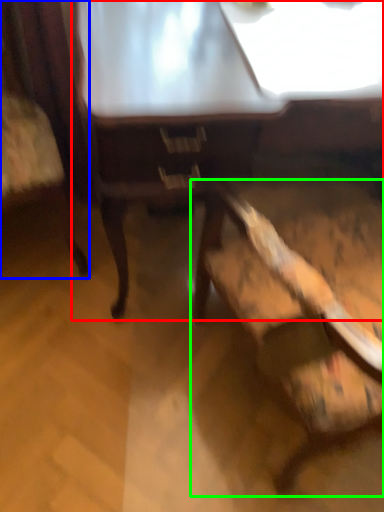
Question: Which object is positioned closest to table (highlighted by a red box)? Select from chair (highlighted by a blue box) and chair (highlighted by a green box).

Choices:
 (A) chair
 (B) chair

Answer: (B)